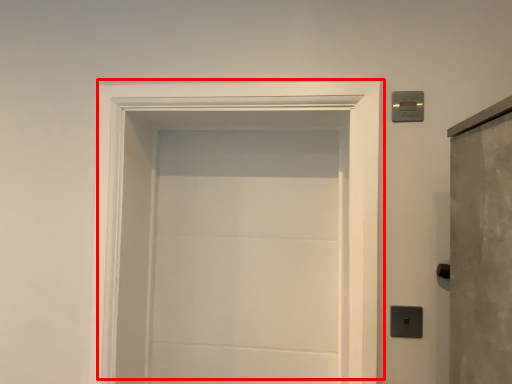
Question: From the image's perspective, where is door (annotated by the red box) located in relation to light switch in the image?

Choices:
 (A) above
 (B) below

Answer: (B)